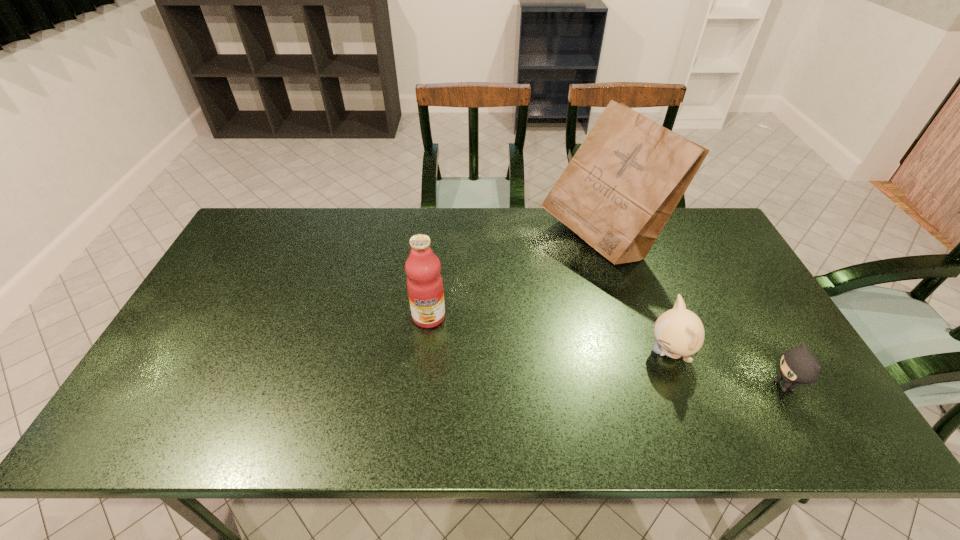
Image resolution: width=960 pixels, height=540 pixels. In order to click on free space between the leftmost object and the taller kitten in this screenshot , I will do `click(549, 334)`.

Where is `vacant point located between the right kitten and the taller kitten`? vacant point located between the right kitten and the taller kitten is located at coordinates (727, 369).

At what (x,y) coordinates should I click in order to perform the action: click on unoccupied area between the grocery bag and the taller kitten. Please return your answer as a coordinate pair (x, y). The image size is (960, 540). Looking at the image, I should click on (636, 296).

At what (x,y) coordinates should I click in order to perform the action: click on free area in between the second farthest object and the right kitten. Please return your answer as a coordinate pair (x, y). This screenshot has height=540, width=960. Looking at the image, I should click on (607, 351).

Where is `object that is the second closest to the taller kitten`? The height and width of the screenshot is (540, 960). object that is the second closest to the taller kitten is located at coordinates (617, 193).

Select which object is the third closest to the left kitten. Please provide its 2D coordinates. Your answer should be formatted as a tuple, i.e. [(x, y)], where the tuple contains the x and y coordinates of a point satisfying the conditions above.

[(424, 282)]